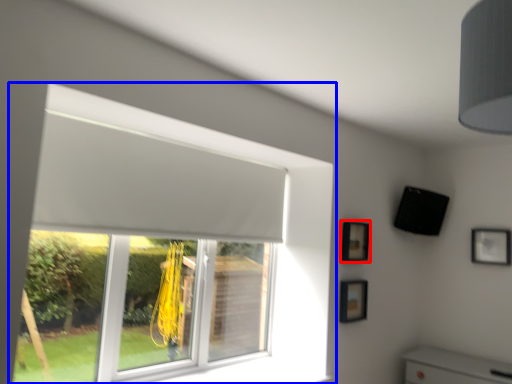
Question: Which point is further to the camera, picture frame (highlighted by a red box) or window (highlighted by a blue box)?

Choices:
 (A) picture frame
 (B) window

Answer: (A)